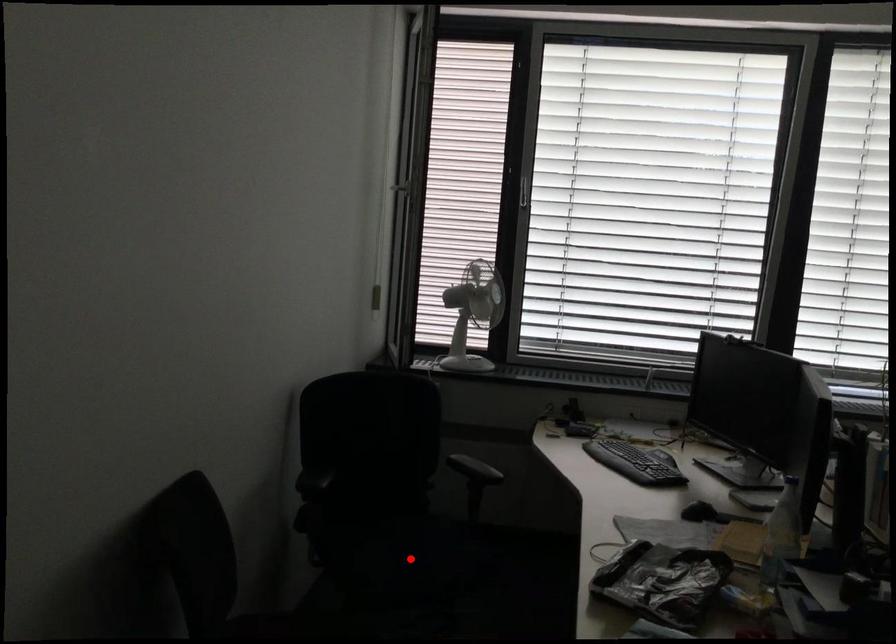
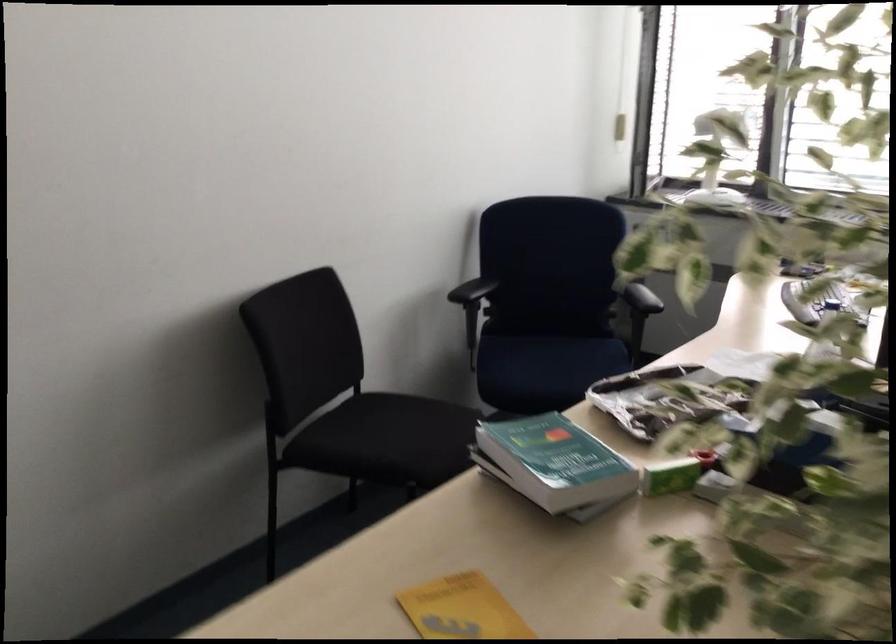
The point at the highlighted location is marked in the first image. Where is the corresponding point in the second image?

(547, 366)